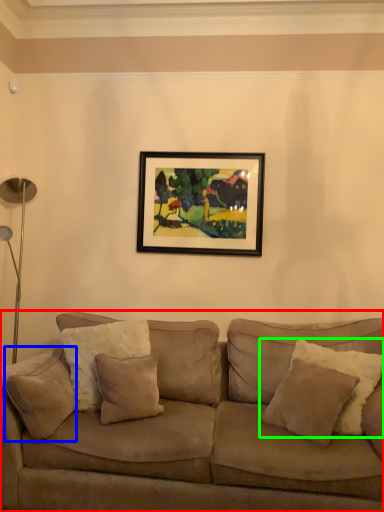
Question: Estimate the real-world distances between objects in this image. Which object is closer to studio couch (highlighted by a red box), pillow (highlighted by a blue box) or pillow (highlighted by a green box)?

Choices:
 (A) pillow
 (B) pillow

Answer: (B)